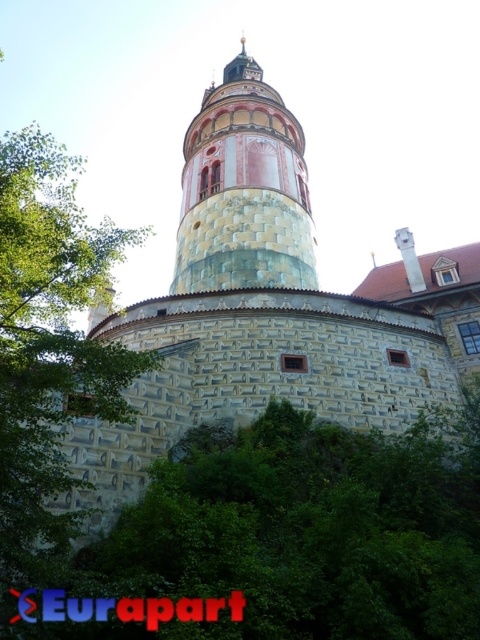
From the picture: You are standing in front of the historic castle and want to take a photo of the green leafy tree at lower center. Based on its position, where should you aim your camera to capture it in the frame?

The green leafy tree at lower center is located at point coordinates approximately 0.828 on the x axis and 0.640 on the y axis, so you should aim your camera towards the lower center area of the image to capture it.

You are standing in front of the historic building and notice a specific point marked at coordinates (307, 529). Based on the scene description, can you determine what this point is located on?

The point at coordinates (307, 529) is located on the green leafy tree at lower center.

You are standing in front of the historic building and want to take a photo that includes both the green leafy tree at lower center and the stone tower at center. Which object will occupy more space in the photo?

The green leafy tree at lower center will occupy more space in the photo because its width is larger than that of the stone tower at center.